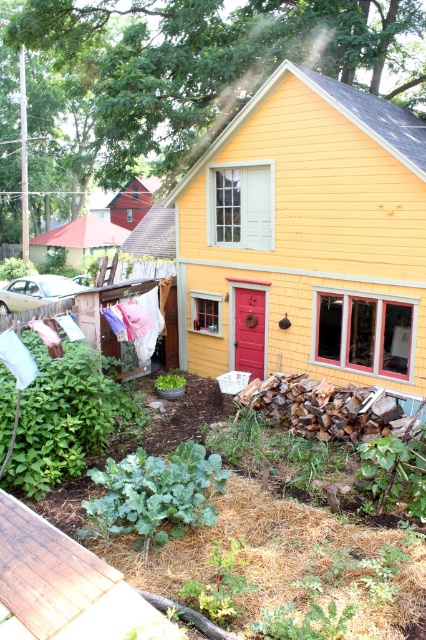
Question: Can you confirm if yellow wood shed at center is thinner than brown wooden deck at lower left?

Choices:
 (A) yes
 (B) no

Answer: (A)

Question: Can you confirm if yellow wood shed at center is thinner than brown wooden deck at lower left?

Choices:
 (A) yes
 (B) no

Answer: (A)

Question: Does yellow wood shed at center appear on the left side of brown wooden deck at lower left?

Choices:
 (A) yes
 (B) no

Answer: (B)

Question: Among these objects, which one is nearest to the camera?

Choices:
 (A) yellow wood shed at center
 (B) brown wooden deck at lower left

Answer: (B)

Question: Which object is farther from the camera taking this photo?

Choices:
 (A) yellow wood shed at center
 (B) brown wooden deck at lower left

Answer: (A)